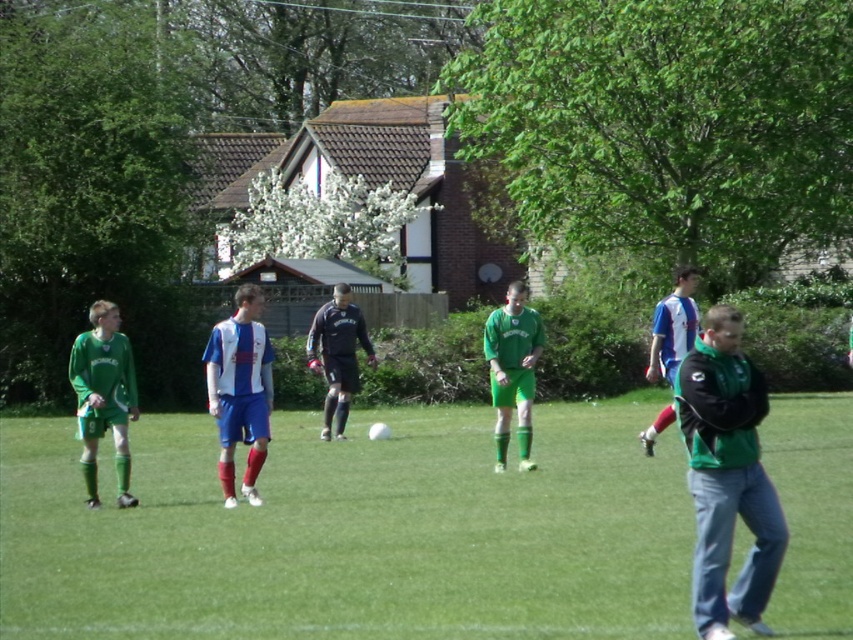
You are a soccer coach analyzing the field. You notice the green matte soccer uniform at center and the dark blue jersey at center. Which player has a narrower uniform width?

The green matte soccer uniform at center has a narrower width than the dark blue jersey at center.

You are a referee observing the soccer match. You notice two players, one wearing the green matte soccer uniform at center and the other in the dark blue jersey at center. Which player is positioned higher up in the image?

The green matte soccer uniform at center is above the dark blue jersey at center, so the player in the green matte soccer uniform at center is positioned higher up in the image.